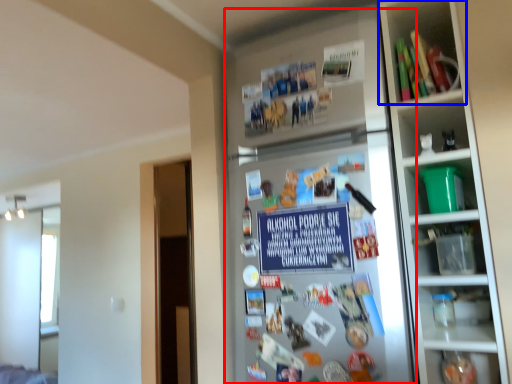
Question: Which point is further to the camera, fridge (highlighted by a red box) or shelf (highlighted by a blue box)?

Choices:
 (A) fridge
 (B) shelf

Answer: (B)